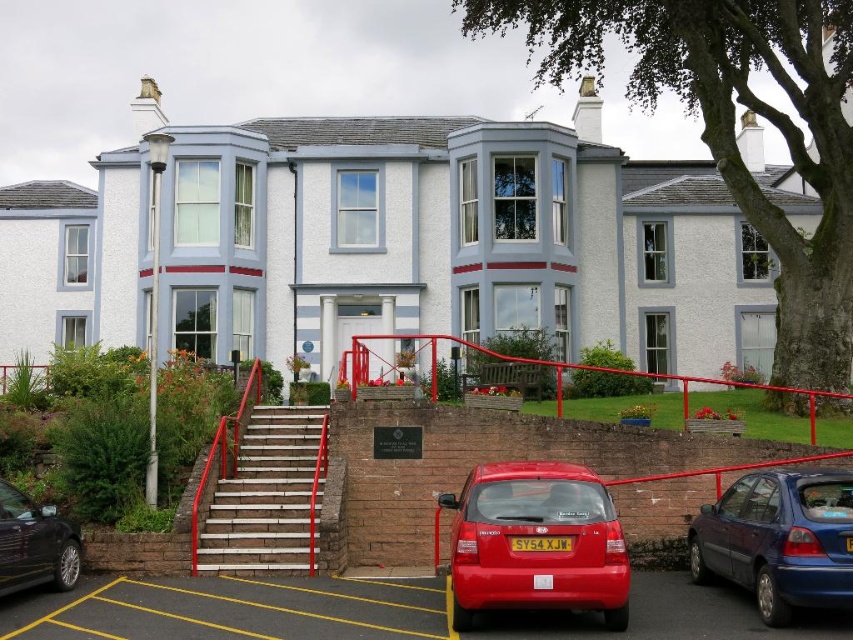
You are standing at the entrance of the two story building. You need to park your car in a spot that is exactly at coordinate 0.848, 0.628. Is the glossy red hatchback at lower right currently occupying that spot?

The glossy red hatchback at lower right is located at point (x=535, y=541), so yes, it is occupying that spot.

You are driving a metallic blue hatchback at lower right and want to park it on the yellow painted asphalt at lower center. Can you fit the car entirely on the asphalt without any part hanging off the edge?

The yellow painted asphalt at lower center has a larger width than the metallic blue hatchback at lower right, so yes, the car can be parked entirely on the asphalt without any part hanging off the edge.

You are driving a car that is 15 feet long and need to park it in the parking area shown in the image. The parking space is marked by the yellow painted asphalt at lower center. There is a metallic blue hatchback at lower right nearby. Can you fit your car into the parking space without overlapping the hatchback?

The distance between the yellow painted asphalt at lower center and the metallic blue hatchback at lower right is 8.73 feet. Since your car is 15 feet long, which is longer than the available space, you cannot fit your car into the parking space without overlapping the hatchback.